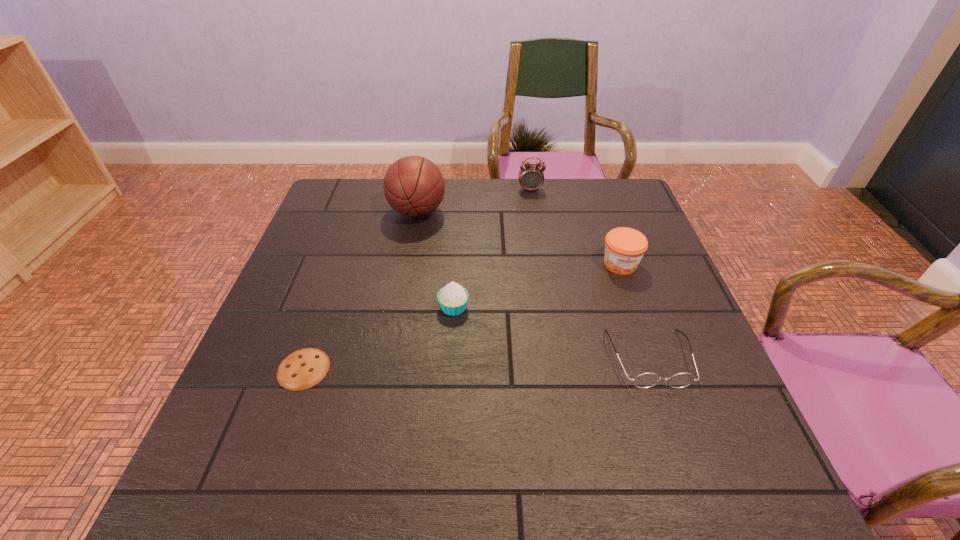
The image size is (960, 540). In order to click on free area in between the second object from left to right and the alarm clock in this screenshot , I will do `click(474, 201)`.

Where is `empty space that is in between the farthest object and the fifth nearest object`? The width and height of the screenshot is (960, 540). empty space that is in between the farthest object and the fifth nearest object is located at coordinates (474, 201).

Locate an element on the screen. vacant region between the jam and the cookie is located at coordinates (462, 316).

At what (x,y) coordinates should I click in order to perform the action: click on free spot between the shortest object and the fourth nearest object. Please return your answer as a coordinate pair (x, y). Looking at the image, I should click on (462, 316).

Locate an element on the screen. This screenshot has width=960, height=540. free space between the third object from left to right and the spectacles is located at coordinates (552, 333).

Where is `vacant area that lies between the leftmost object and the fifth nearest object`? The width and height of the screenshot is (960, 540). vacant area that lies between the leftmost object and the fifth nearest object is located at coordinates (360, 291).

You are a GUI agent. You are given a task and a screenshot of the screen. Output one action in this format:
    pyautogui.click(x=<x>, y=<y>)
    Task: Click on the vacant space that is in between the shortest object and the fourth nearest object
    This screenshot has width=960, height=540.
    Given the screenshot: What is the action you would take?
    pyautogui.click(x=462, y=316)

Locate which object ranks fifth in proximity to the second shortest object. Please provide its 2D coordinates. Your answer should be formatted as a tuple, i.e. [(x, y)], where the tuple contains the x and y coordinates of a point satisfying the conditions above.

[(304, 368)]

Point out which object is positioned as the fifth nearest to the spectacles. Please provide its 2D coordinates. Your answer should be formatted as a tuple, i.e. [(x, y)], where the tuple contains the x and y coordinates of a point satisfying the conditions above.

[(304, 368)]